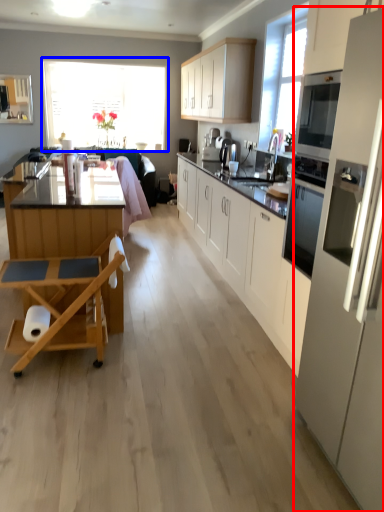
Question: Which object appears closest to the camera in this image, kitchen appliance (highlighted by a red box) or window (highlighted by a blue box)?

Choices:
 (A) kitchen appliance
 (B) window

Answer: (A)